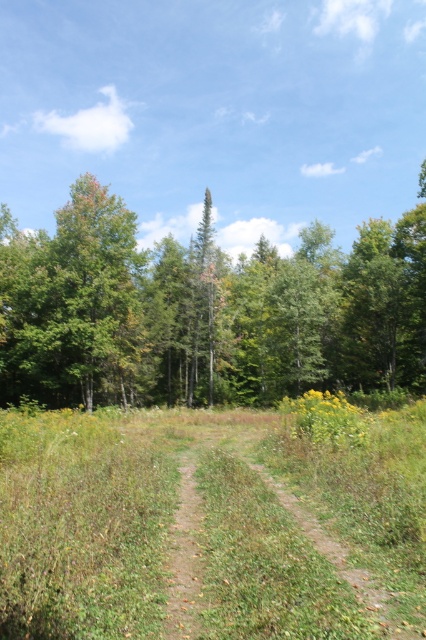
From the picture: Who is taller, green leafy tree at center or yellow-green textured wildflower at right?

With more height is green leafy tree at center.

Does point (94, 241) come farther from viewer compared to point (362, 412)?

Yes, it is.

Where is `green leafy tree at center`? The width and height of the screenshot is (426, 640). green leafy tree at center is located at coordinates (204, 310).

Can you confirm if green grassy path at center is positioned below yellow-green textured wildflower at right?

Actually, green grassy path at center is above yellow-green textured wildflower at right.

Which is above, green grassy path at center or yellow-green textured wildflower at right?

green grassy path at center is higher up.

Which is in front, point (89, 538) or point (319, 420)?

Point (89, 538) is in front.

Image resolution: width=426 pixels, height=640 pixels. What are the coordinates of `green grassy path at center` in the screenshot? It's located at (209, 525).

Which is more to the left, green grassy path at center or green leafy tree at center?

green leafy tree at center

Does green grassy path at center have a smaller size compared to green leafy tree at center?

Indeed, green grassy path at center has a smaller size compared to green leafy tree at center.

I want to click on green grassy path at center, so tap(209, 525).